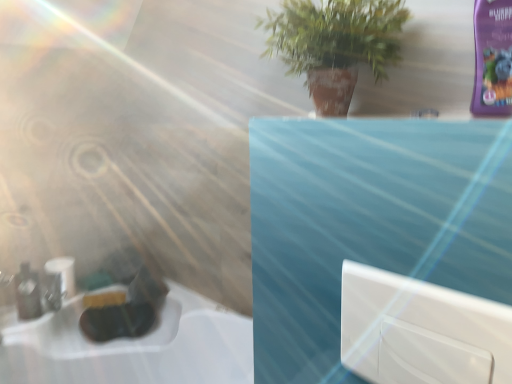
Question: Would you say matte black bottle at left is outside white matte toilet paper at lower left?

Choices:
 (A) yes
 (B) no

Answer: (A)

Question: From the image's perspective, would you say matte black bottle at left is shown under white matte toilet paper at lower left?

Choices:
 (A) no
 (B) yes

Answer: (B)

Question: Does matte black bottle at left appear on the right side of white matte toilet paper at lower left?

Choices:
 (A) yes
 (B) no

Answer: (B)

Question: Is the depth of matte black bottle at left less than that of white matte toilet paper at lower left?

Choices:
 (A) no
 (B) yes

Answer: (B)

Question: From a real-world perspective, is matte black bottle at left physically above white matte toilet paper at lower left?

Choices:
 (A) yes
 (B) no

Answer: (A)

Question: Considering the relative positions of matte black bottle at left and white matte toilet paper at lower left in the image provided, is matte black bottle at left to the left of white matte toilet paper at lower left from the viewer's perspective?

Choices:
 (A) yes
 (B) no

Answer: (A)

Question: Does green matte plant at upper center have a lesser width compared to white matte toilet paper at lower left?

Choices:
 (A) no
 (B) yes

Answer: (A)

Question: Considering the relative sizes of green matte plant at upper center and white matte toilet paper at lower left in the image provided, is green matte plant at upper center shorter than white matte toilet paper at lower left?

Choices:
 (A) yes
 (B) no

Answer: (B)

Question: Is green matte plant at upper center touching white matte toilet paper at lower left?

Choices:
 (A) no
 (B) yes

Answer: (A)

Question: Can you confirm if green matte plant at upper center is bigger than white matte toilet paper at lower left?

Choices:
 (A) no
 (B) yes

Answer: (B)

Question: From the image's perspective, is green matte plant at upper center located above white matte toilet paper at lower left?

Choices:
 (A) yes
 (B) no

Answer: (A)

Question: Considering the relative positions of green matte plant at upper center and white matte toilet paper at lower left in the image provided, is green matte plant at upper center in front of white matte toilet paper at lower left?

Choices:
 (A) yes
 (B) no

Answer: (A)

Question: Considering the relative positions of white glossy window at center and green matte plant at upper center in the image provided, is white glossy window at center to the right of green matte plant at upper center from the viewer's perspective?

Choices:
 (A) no
 (B) yes

Answer: (B)